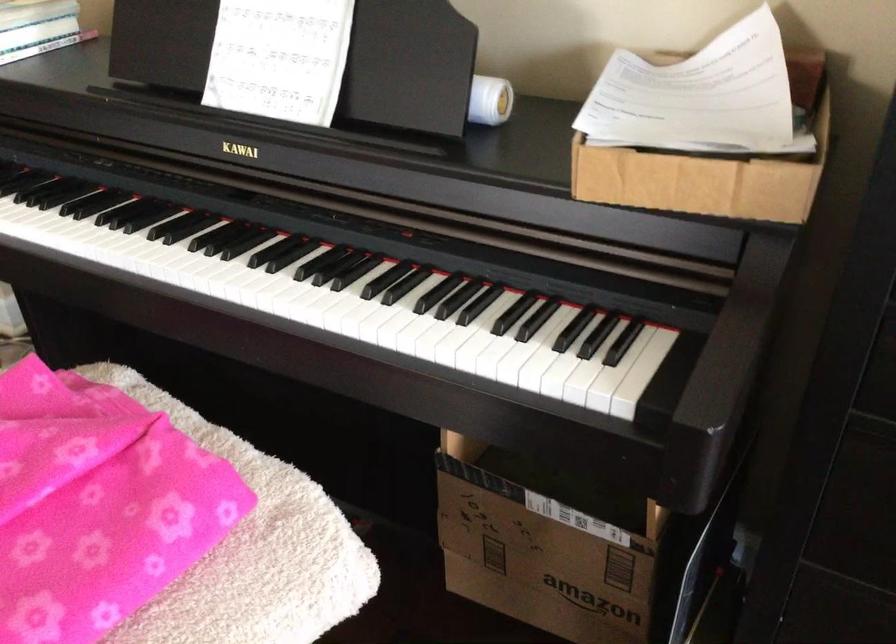
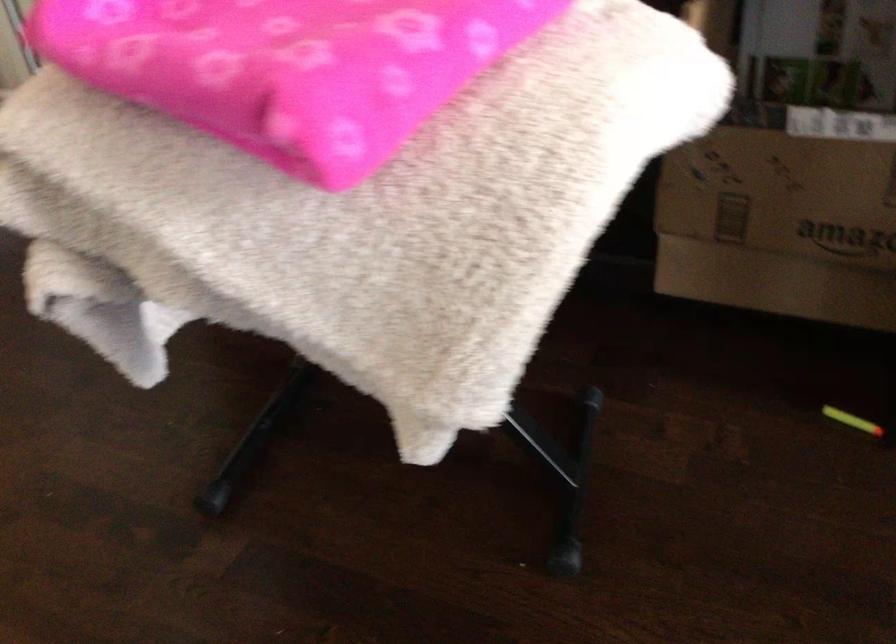
Locate, in the second image, the point that corresponds to (531,573) in the first image.

(780, 225)